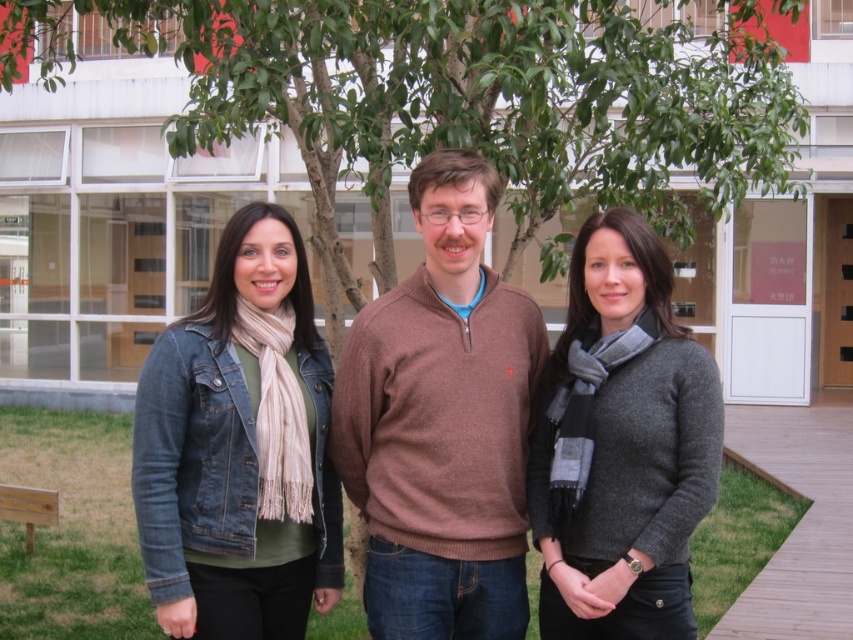
Based on the photo, you are standing in front of the modern building and want to greet both the person wearing the denim jacket at left and the person wearing the gray wool sweater at center. Which person should you approach first based on their proximity to you?

You should approach the person wearing the denim jacket at left first because they are closer to you than the gray wool sweater at center, who is further away.